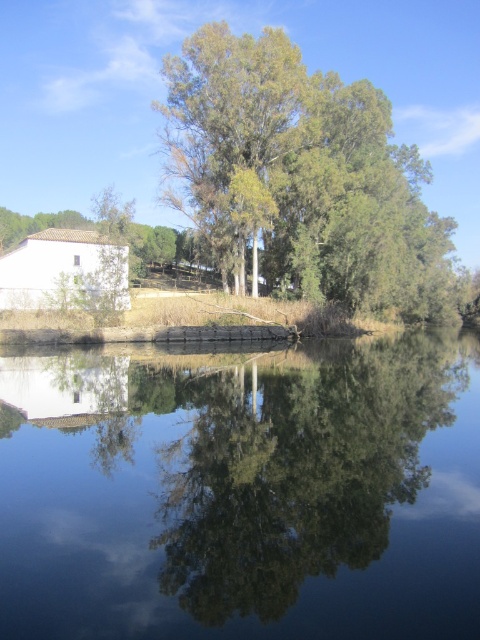
Question: Which of the following is the farthest from the observer?

Choices:
 (A) green leafy tree at upper center
 (B) transparent glass lake at center

Answer: (A)

Question: Which point appears closest to the camera in this image?

Choices:
 (A) (359, 380)
 (B) (186, 131)

Answer: (A)

Question: Does transparent glass lake at center have a lesser width compared to green leafy tree at upper center?

Choices:
 (A) no
 (B) yes

Answer: (B)

Question: Is transparent glass lake at center thinner than green leafy tree at upper center?

Choices:
 (A) no
 (B) yes

Answer: (B)

Question: Is transparent glass lake at center to the right of green leafy tree at upper center from the viewer's perspective?

Choices:
 (A) no
 (B) yes

Answer: (A)